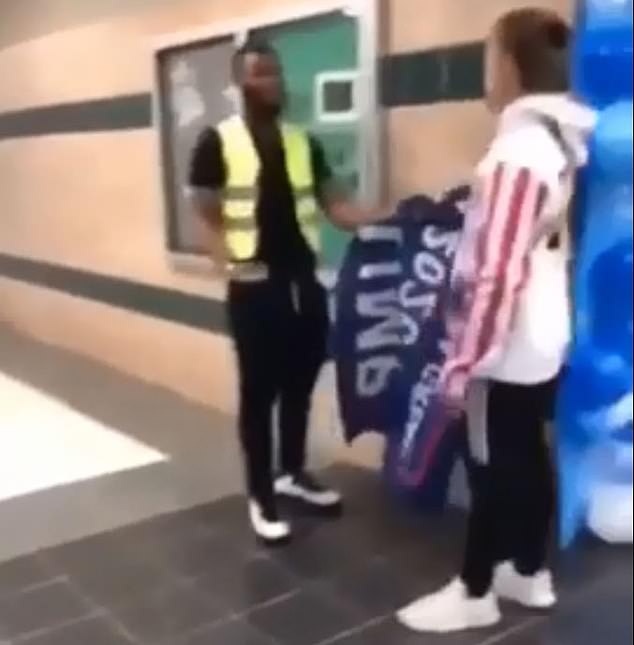
I want to click on black stripes on the wall, so click(x=91, y=117), click(x=100, y=288).